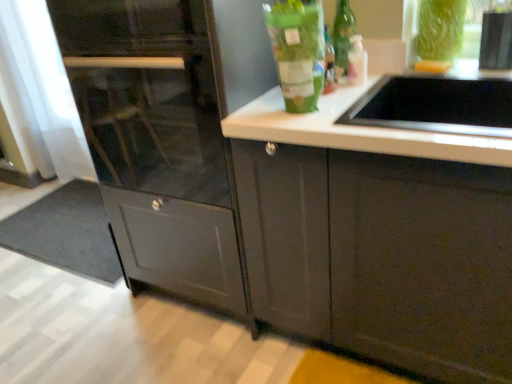
Question: Does gray matte doormat at lower left have a greater width compared to matte gray cabinet at center?

Choices:
 (A) no
 (B) yes

Answer: (B)

Question: Could you tell me if gray matte doormat at lower left is facing matte gray cabinet at center?

Choices:
 (A) yes
 (B) no

Answer: (B)

Question: From the image's perspective, is gray matte doormat at lower left on matte gray cabinet at center?

Choices:
 (A) yes
 (B) no

Answer: (B)

Question: Is gray matte doormat at lower left further to camera compared to matte gray cabinet at center?

Choices:
 (A) yes
 (B) no

Answer: (A)

Question: Can you confirm if gray matte doormat at lower left is positioned to the right of matte gray cabinet at center?

Choices:
 (A) yes
 (B) no

Answer: (B)

Question: Can matte gray cabinet at center be found inside gray matte doormat at lower left?

Choices:
 (A) yes
 (B) no

Answer: (B)

Question: Does green glass vase at upper right turn towards green matte bag at upper center, the second bottle positioned from the back?

Choices:
 (A) no
 (B) yes

Answer: (A)

Question: From the image's perspective, is green glass vase at upper right under green matte bag at upper center, which is counted as the 1th bottle, starting from the front?

Choices:
 (A) no
 (B) yes

Answer: (A)

Question: Can you confirm if green glass vase at upper right is positioned to the left of green matte bag at upper center, the 1th bottle viewed from the left?

Choices:
 (A) yes
 (B) no

Answer: (B)

Question: Is green glass vase at upper right further to the viewer compared to green matte bag at upper center, which is counted as the second bottle, starting from the right?

Choices:
 (A) yes
 (B) no

Answer: (A)

Question: Considering the relative sizes of green glass vase at upper right and green matte bag at upper center, the second bottle positioned from the back, in the image provided, is green glass vase at upper right shorter than green matte bag at upper center, the second bottle positioned from the back,?

Choices:
 (A) no
 (B) yes

Answer: (B)

Question: Can you confirm if green glass vase at upper right is bigger than green matte bag at upper center, the 1th bottle viewed from the left?

Choices:
 (A) yes
 (B) no

Answer: (B)

Question: Is translucent glass bottle at upper right, placed as the first bottle when sorted from right to left, further to the viewer compared to gray matte doormat at lower left?

Choices:
 (A) yes
 (B) no

Answer: (B)